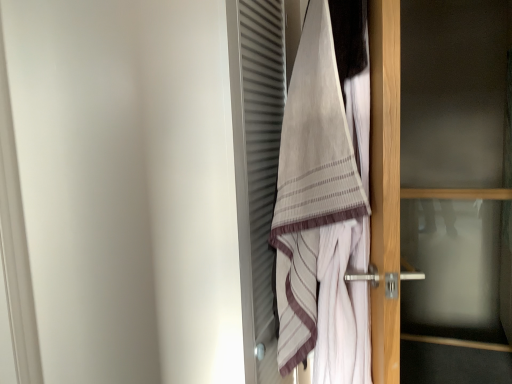
Question: Can you confirm if transparent glass door at right is positioned to the right of beige striped towel at center?

Choices:
 (A) yes
 (B) no

Answer: (A)

Question: From the image's perspective, is transparent glass door at right beneath beige striped towel at center?

Choices:
 (A) yes
 (B) no

Answer: (A)

Question: Does transparent glass door at right have a lesser height compared to beige striped towel at center?

Choices:
 (A) yes
 (B) no

Answer: (B)

Question: Could beige striped towel at center be considered to be inside transparent glass door at right?

Choices:
 (A) no
 (B) yes

Answer: (A)

Question: Is transparent glass door at right behind beige striped towel at center?

Choices:
 (A) yes
 (B) no

Answer: (A)

Question: Considering the relative positions of transparent glass door at right and beige striped towel at center in the image provided, is transparent glass door at right to the left of beige striped towel at center from the viewer's perspective?

Choices:
 (A) yes
 (B) no

Answer: (B)

Question: Is beige striped towel at center positioned far away from transparent glass door at right?

Choices:
 (A) yes
 (B) no

Answer: (B)

Question: Is beige striped towel at center looking in the opposite direction of transparent glass door at right?

Choices:
 (A) no
 (B) yes

Answer: (A)

Question: From the image's perspective, is beige striped towel at center beneath transparent glass door at right?

Choices:
 (A) yes
 (B) no

Answer: (B)

Question: From the image's perspective, is beige striped towel at center on transparent glass door at right?

Choices:
 (A) no
 (B) yes

Answer: (B)

Question: Considering the relative sizes of beige striped towel at center and transparent glass door at right in the image provided, is beige striped towel at center thinner than transparent glass door at right?

Choices:
 (A) yes
 (B) no

Answer: (B)

Question: Can you confirm if beige striped towel at center is bigger than transparent glass door at right?

Choices:
 (A) no
 (B) yes

Answer: (A)

Question: Looking at their shapes, would you say beige striped towel at center is wider or thinner than transparent glass door at right?

Choices:
 (A) thin
 (B) wide

Answer: (B)